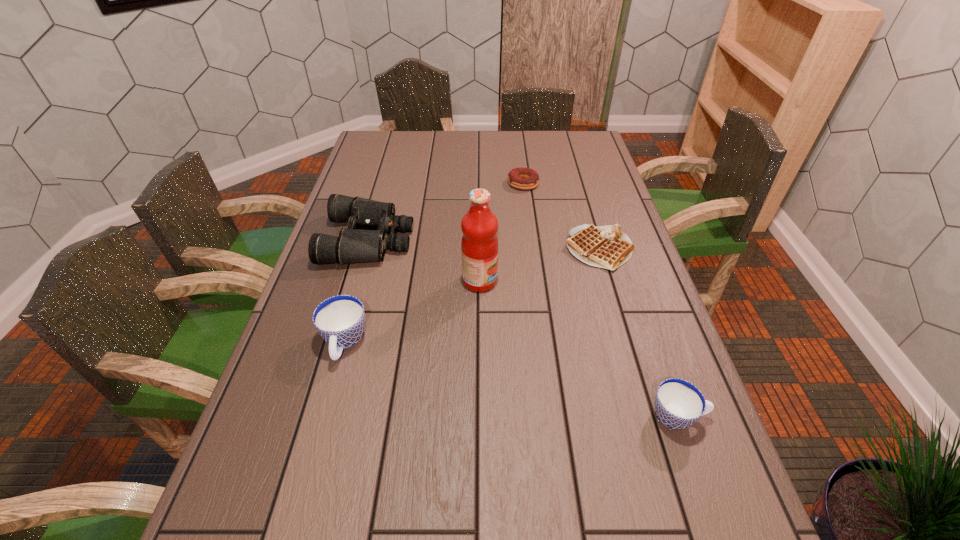
The height and width of the screenshot is (540, 960). Find the location of `the farther cup`. the farther cup is located at coordinates (340, 320).

Where is `the fifth farthest object`? The image size is (960, 540). the fifth farthest object is located at coordinates (340, 320).

You are a GUI agent. You are given a task and a screenshot of the screen. Output one action in this format:
    pyautogui.click(x=<x>, y=<y>)
    Task: Click on the third shortest object
    The image size is (960, 540).
    Given the screenshot: What is the action you would take?
    pyautogui.click(x=678, y=403)

This screenshot has width=960, height=540. In order to click on the nearer cup in this screenshot , I will do [678, 403].

At what (x,y) coordinates should I click in order to perform the action: click on the fourth object from left to right. Please return your answer as a coordinate pair (x, y). The height and width of the screenshot is (540, 960). Looking at the image, I should click on (522, 178).

Locate an element on the screen. Image resolution: width=960 pixels, height=540 pixels. the farthest object is located at coordinates (522, 178).

Where is `fruit juice`? The height and width of the screenshot is (540, 960). fruit juice is located at coordinates (479, 245).

Image resolution: width=960 pixels, height=540 pixels. What are the coordinates of `the third object from left to right` in the screenshot? It's located at point(479,245).

The height and width of the screenshot is (540, 960). Find the location of `binoculars`. binoculars is located at coordinates (353, 245).

What are the coordinates of `waffle` in the screenshot? It's located at (608, 247).